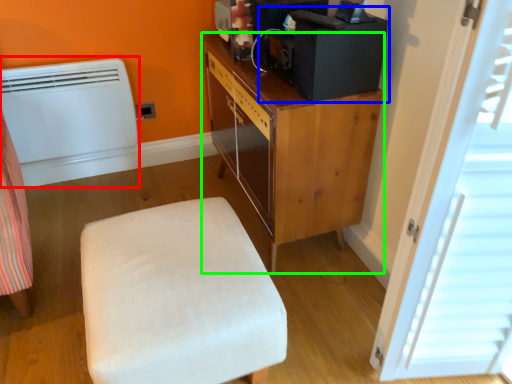
Question: Which is nearer to the heater (highlighted by a red box)? desktop computer (highlighted by a blue box) or cabinetry (highlighted by a green box).

Choices:
 (A) desktop computer
 (B) cabinetry

Answer: (B)